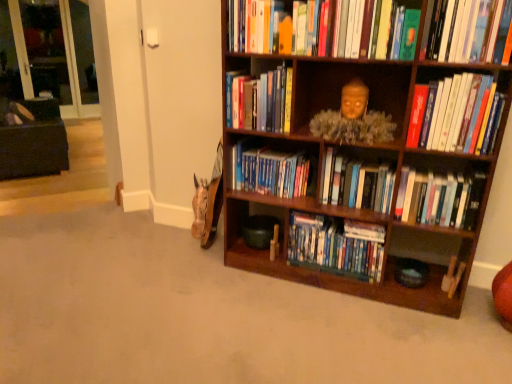
What are the coordinates of `vacant space to the left of wooden bookcase at right` in the screenshot? It's located at (189, 291).